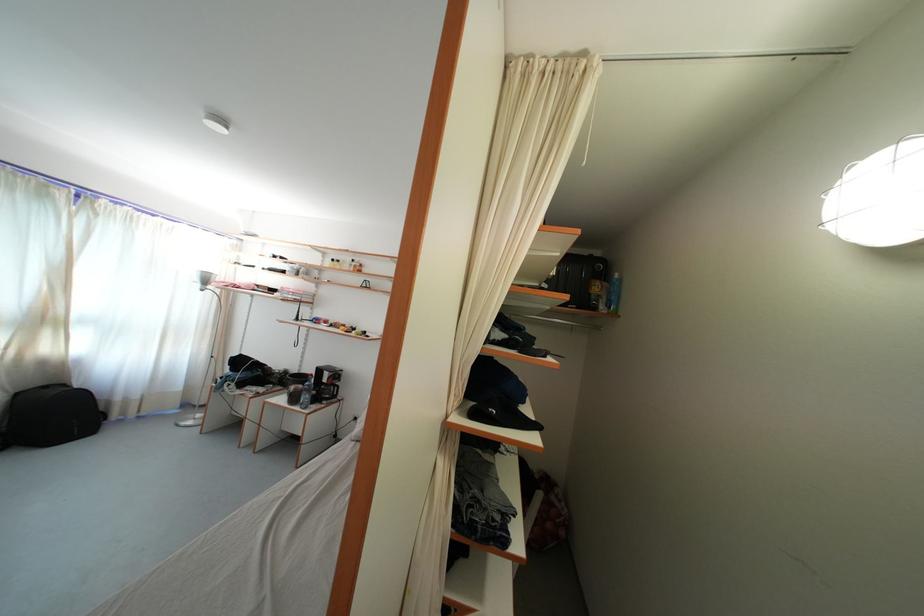
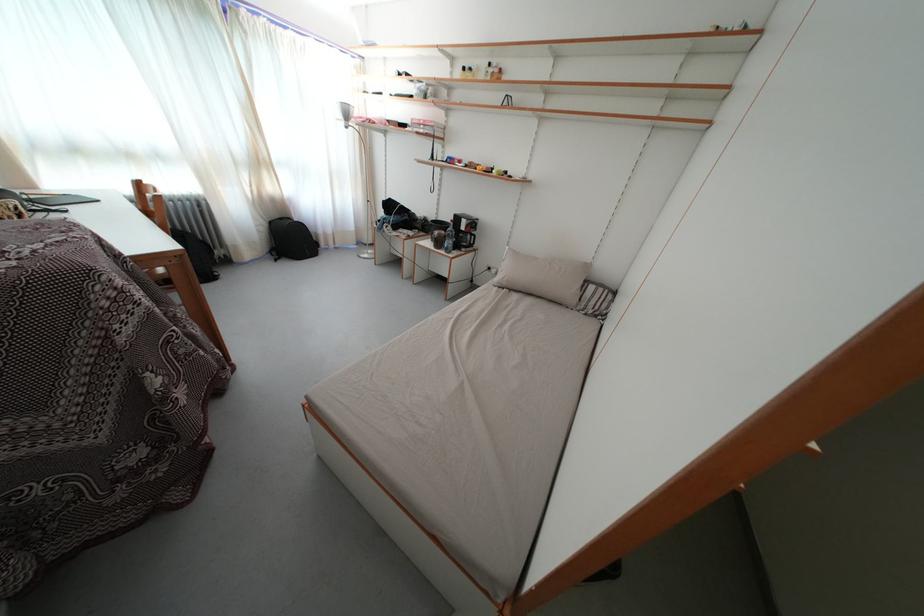
The point at (x=367, y=426) is marked in the first image. Where is the corresponding point in the second image?

(500, 276)